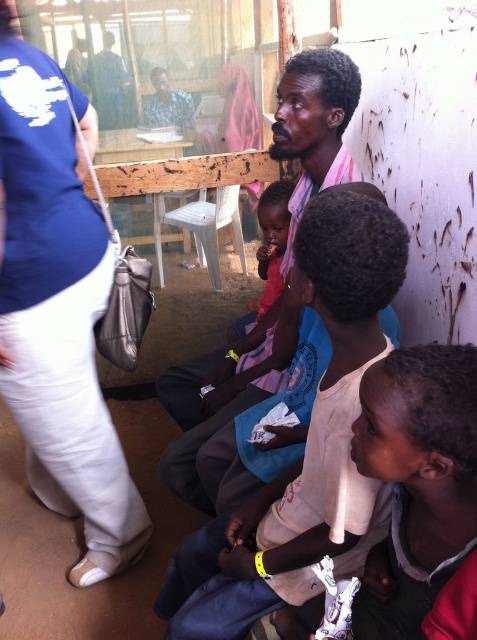
You are observing a group of people in an indoor setting. You notice two individuals wearing shirts. One is wearing a blue fabric shirt at left and another is wearing a white cotton shirt at lower right. Which shirt is positioned higher in the image?

The blue fabric shirt at left is positioned higher than the white cotton shirt at lower right in the image.

You are a photographer trying to capture a candid shot of the scene. You want to ensure that both the blue fabric shirt at left and the pink fabric at center are in the frame. Based on their positions, which object should you focus on first to include both in your shot?

The blue fabric shirt at left is to the left of the pink fabric at center, so you should focus on the pink fabric at center first to ensure both are included in the frame.

What is located at the coordinates point (58,314) in the image?

A blue fabric shirt at left is located at point (58,314).